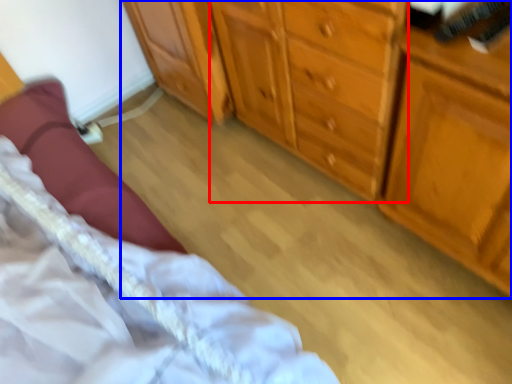
Question: Which of the following is the closest to the observer, cabinetry (highlighted by a red box) or chest of drawers (highlighted by a blue box)?

Choices:
 (A) cabinetry
 (B) chest of drawers

Answer: (B)